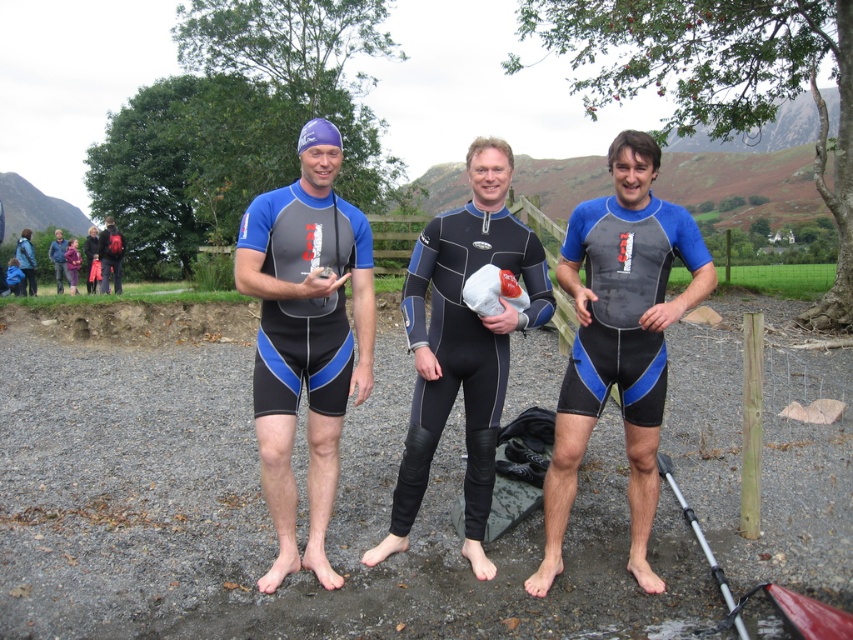
Question: Among these objects, which one is nearest to the camera?

Choices:
 (A) matte black wetsuit at left
 (B) dark blue neoprene wetsuit at center
 (C) matte black wetsuit at center

Answer: (C)

Question: Does matte black wetsuit at center appear on the right side of dark blue neoprene wetsuit at center?

Choices:
 (A) no
 (B) yes

Answer: (B)

Question: Which point is closer to the camera?

Choices:
 (A) [x=306, y=314]
 (B) [x=459, y=246]
 (C) [x=537, y=572]

Answer: (A)

Question: Can you confirm if matte black wetsuit at left is positioned below matte black wetsuit at center?

Choices:
 (A) no
 (B) yes

Answer: (A)

Question: Does matte black wetsuit at left have a greater width compared to matte black wetsuit at center?

Choices:
 (A) yes
 (B) no

Answer: (B)

Question: Based on their relative distances, which object is nearer to the matte black wetsuit at left?

Choices:
 (A) dark blue neoprene wetsuit at center
 (B) matte black wetsuit at center

Answer: (A)